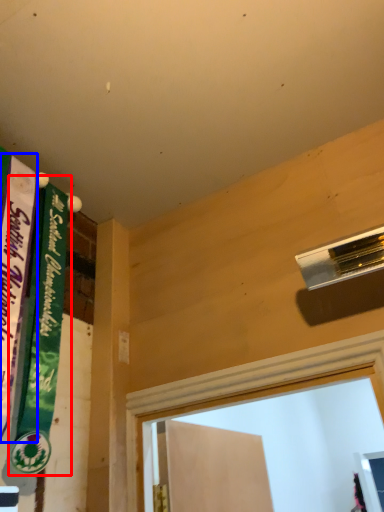
Question: Which of the following is the farthest to the observer, bulletin board (highlighted by a red box) or bulletin board (highlighted by a blue box)?

Choices:
 (A) bulletin board
 (B) bulletin board

Answer: (A)